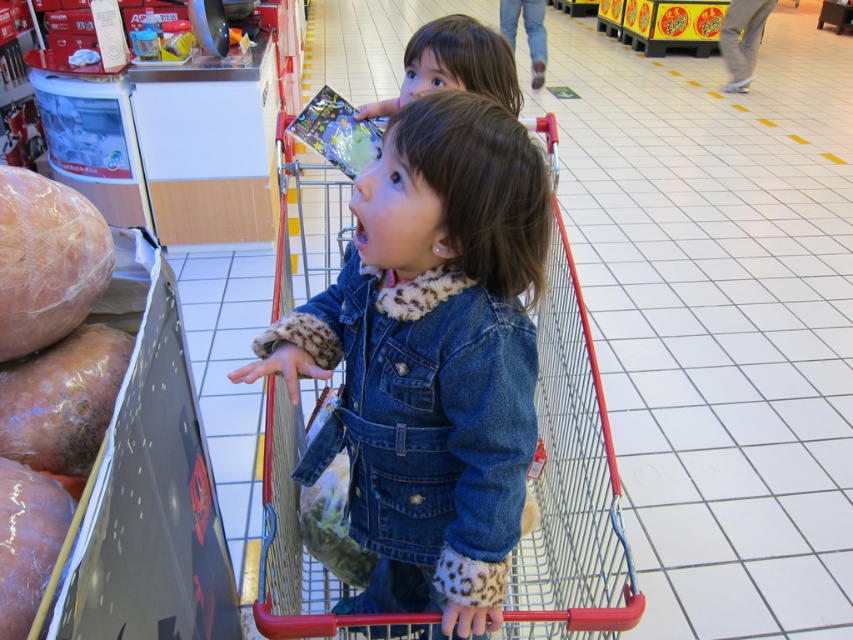
Please look at the red shopping cart with two children. There is a point marked at coordinates (422, 408). Which object does this point correspond to?

The point at coordinates (422, 408) corresponds to the denim jacket at lower right.

You are standing at the entrance of the supermarket and see the metallic red shopping cart at center and the denim jacket at lower right. Which object is nearer to you?

The metallic red shopping cart at center is closer to the viewer than the denim jacket at lower right, so the metallic red shopping cart at center is nearer to you.

You are a customer in a supermarket. You see a metallic red shopping cart at center and a smooth brown sausage at left. Which object is taller?

The metallic red shopping cart at center is much taller than the smooth brown sausage at left.